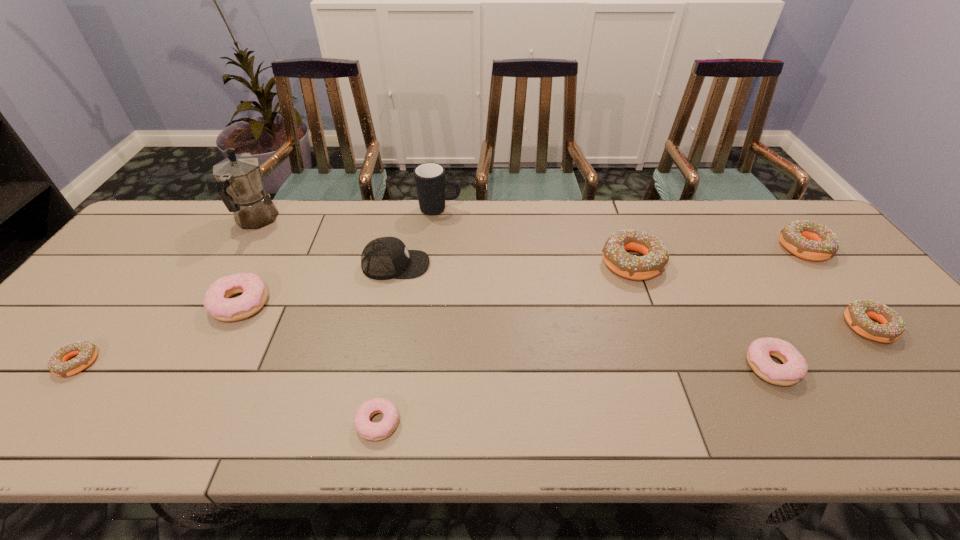
In order to click on the rightmost pink doughnut in this screenshot , I will do `click(794, 368)`.

Identify the location of the smallest chocolate doughnut. The image size is (960, 540). (86, 352).

This screenshot has height=540, width=960. What are the coordinates of `the nearest chocolate doughnut` in the screenshot? It's located at (86, 352).

This screenshot has height=540, width=960. What are the coordinates of `the nearest pink doughnut` in the screenshot? It's located at coord(368,430).

Image resolution: width=960 pixels, height=540 pixels. What are the coordinates of `the smallest pink doughnut` in the screenshot? It's located at (368, 430).

At what (x,y) coordinates should I click in order to perform the action: click on vacant space located 0.060m on the side of the ninth shortest object with the handle. Please return your answer as a coordinate pair (x, y). The image size is (960, 540). Looking at the image, I should click on (480, 209).

Locate an element on the screen. This screenshot has width=960, height=540. vacant space located on the front-facing side of the cap is located at coordinates (511, 265).

Where is `vacant space situated 0.260m on the right of the biggest chocolate doughnut`? The height and width of the screenshot is (540, 960). vacant space situated 0.260m on the right of the biggest chocolate doughnut is located at coordinates (755, 262).

You are a GUI agent. You are given a task and a screenshot of the screen. Output one action in this format:
    pyautogui.click(x=<x>, y=<y>)
    Task: Click on the vacant space located on the front of the third smallest chocolate doughnut
    Image resolution: width=960 pixels, height=540 pixels.
    Given the screenshot: What is the action you would take?
    pyautogui.click(x=905, y=370)

Find the location of a particular element. The width and height of the screenshot is (960, 540). vacant region located on the back of the biggest pink doughnut is located at coordinates (269, 249).